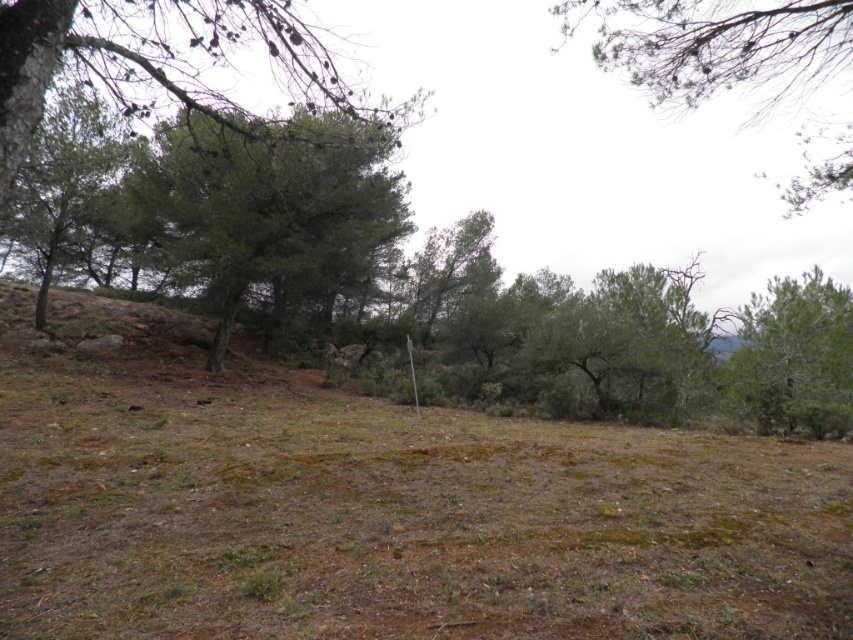
You are standing in the middle of the outdoor scene and want to take a photo of both the green leafy tree at upper center and the green textured tree at right. Which tree should you aim your camera upwards to include in your shot?

You should aim your camera upwards to include the green leafy tree at upper center because it is located above the green textured tree at right.

You are standing at the origin point in the image. Which direction should you move to reach the green textured tree at center?

The green textured tree at center is located at coordinates point (265, 211), so you should move northeast to reach it.

You are standing in the natural outdoor scene described. You want to take a photo of the green leafy tree at upper center. Where should you position yourself to capture it in the center of your camera viewfinder?

To capture the green leafy tree at upper center in the center of your camera viewfinder, position yourself directly in front of it, aligning the crosshairs of your viewfinder with its central point at coordinates approximately 0.072 on the x and 0.843 on the y axis.